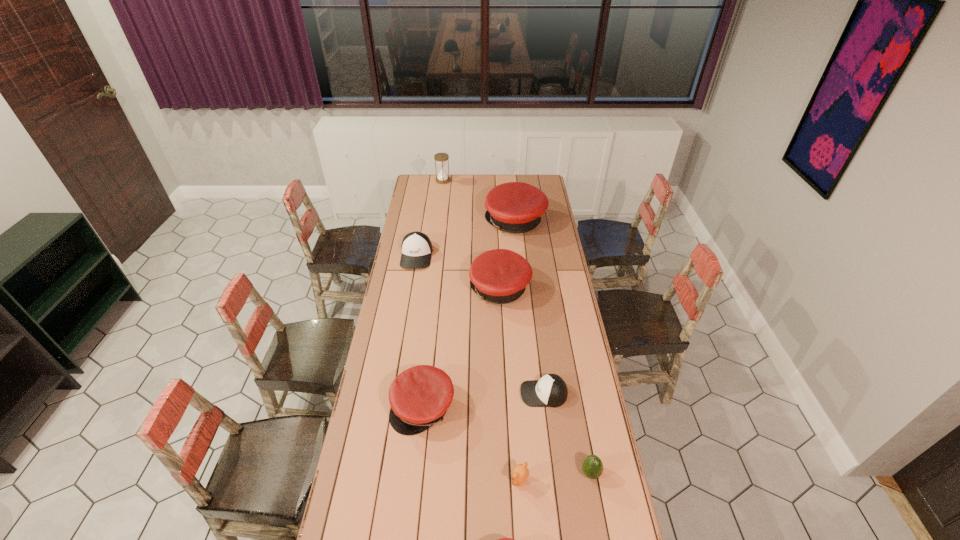
You are a GUI agent. You are given a task and a screenshot of the screen. Output one action in this format:
    pyautogui.click(x=<x>, y=<y>)
    Task: Click on the white hourglass
    The width and height of the screenshot is (960, 540).
    Given the screenshot: What is the action you would take?
    pyautogui.click(x=441, y=158)

Identify the location of the farthest object. The image size is (960, 540). (441, 158).

Locate an element on the screen. the farthest red cap is located at coordinates (516, 207).

The width and height of the screenshot is (960, 540). Find the location of `the farthest cap`. the farthest cap is located at coordinates (516, 207).

Locate an element on the screen. This screenshot has width=960, height=540. the third nearest red cap is located at coordinates (500, 276).

In order to click on the fifth shortest cap in this screenshot , I will do `click(500, 276)`.

Image resolution: width=960 pixels, height=540 pixels. I want to click on the left gray cap, so click(x=416, y=247).

At what (x,y) coordinates should I click in order to perform the action: click on the farther gray cap. Please return your answer as a coordinate pair (x, y). The height and width of the screenshot is (540, 960). Looking at the image, I should click on (416, 247).

Where is `the second smallest red cap`? The height and width of the screenshot is (540, 960). the second smallest red cap is located at coordinates (420, 396).

This screenshot has height=540, width=960. I want to click on the second nearest red cap, so click(x=420, y=396).